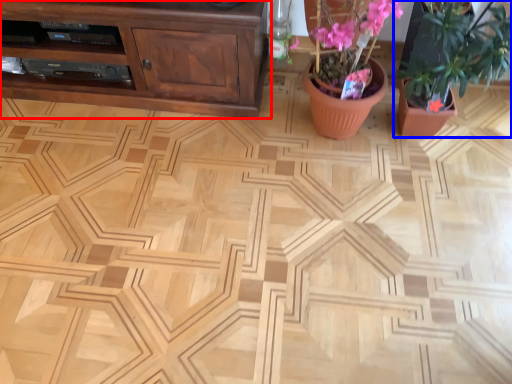
Question: Among these objects, which one is nearest to the camera, cabinetry (highlighted by a red box) or houseplant (highlighted by a blue box)?

Choices:
 (A) cabinetry
 (B) houseplant

Answer: (B)